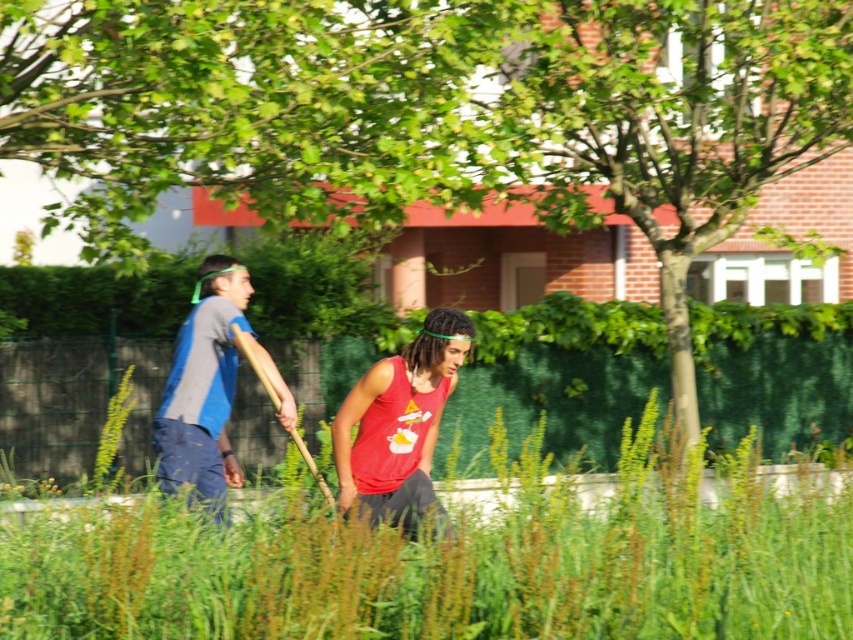
Who is shorter, matte red tank top at center or blue fabric shirt at left?

Standing shorter between the two is matte red tank top at center.

Is matte red tank top at center thinner than blue fabric shirt at left?

Correct, matte red tank top at center's width is less than blue fabric shirt at left's.

Between point (431, 486) and point (213, 378), which one is positioned behind?

The point (213, 378) is behind.

The height and width of the screenshot is (640, 853). In order to click on matte red tank top at center in this screenshot , I will do `click(399, 422)`.

Does green grass at center have a greater width compared to blue fabric shirt at left?

Yes, green grass at center is wider than blue fabric shirt at left.

Can you confirm if green grass at center is positioned above blue fabric shirt at left?

No, green grass at center is not above blue fabric shirt at left.

Identify the location of green grass at center. (451, 566).

Identify the location of green grass at center. The width and height of the screenshot is (853, 640). (451, 566).

Who is lower down, green grass at center or matte red tank top at center?

green grass at center is lower down.

Consider the image. Who is more distant from viewer, [643,588] or [407,528]?

The point [407,528] is behind.

Which is in front, point (163, 561) or point (352, 419)?

Point (163, 561) is in front.

Image resolution: width=853 pixels, height=640 pixels. Identify the location of green grass at center. (451, 566).